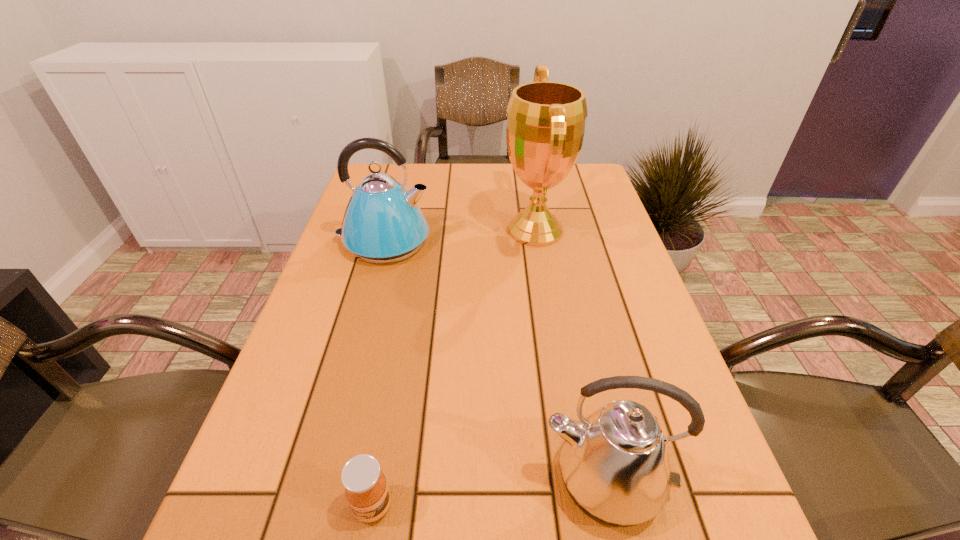
What are the coordinates of `vacant area in the image that satisfies the following two spatial constraints: 1. on the front-facing side of the tallest object; 2. on the front-facing side of the honey` in the screenshot? It's located at [x=581, y=506].

Find the location of a particular element. vacant area that satisfies the following two spatial constraints: 1. at the spout of the left kettle; 2. on the right side of the right kettle is located at coordinates (319, 480).

This screenshot has width=960, height=540. In order to click on vacant space that satisfies the following two spatial constraints: 1. at the spout of the right kettle; 2. on the left side of the farther kettle in this screenshot , I will do `click(319, 480)`.

Where is `vacant region that satisfies the following two spatial constraints: 1. at the spout of the right kettle; 2. on the right side of the farther kettle`? The height and width of the screenshot is (540, 960). vacant region that satisfies the following two spatial constraints: 1. at the spout of the right kettle; 2. on the right side of the farther kettle is located at coordinates pos(319,480).

What are the coordinates of `free region that satisfies the following two spatial constraints: 1. at the spout of the nearer kettle; 2. on the left side of the farther kettle` in the screenshot? It's located at (319, 480).

Identify the location of free location that satisfies the following two spatial constraints: 1. on the front-facing side of the tallest object; 2. on the back side of the right kettle. This screenshot has height=540, width=960. (576, 480).